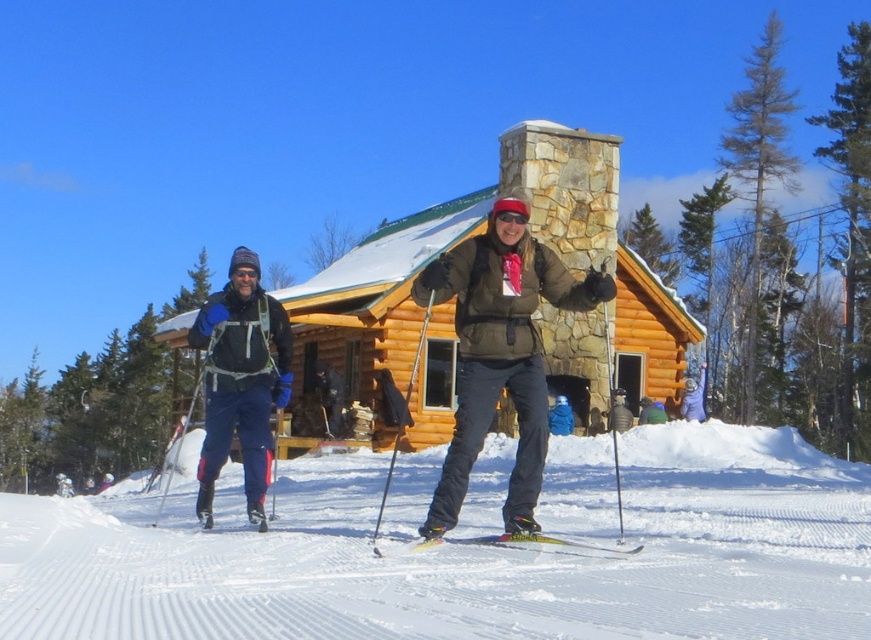
You are a photographer standing in front of the rustic wooden cabin. You want to take a photo of the two skiers. The first skier is at point [281,320] and the second is at point [451,540]. Which skier will appear closer to the camera in the photo?

The skier at point [281,320] will appear closer to the camera in the photo because it is further to the camera than point [451,540].

You are a photographer trying to capture a photo of the yellow metallic ski at center. You see the brushed metal ski pole at left in the scene. Which object is positioned more to the left side of the image?

The brushed metal ski pole at left is positioned more to the left side of the image compared to the yellow metallic ski at center.